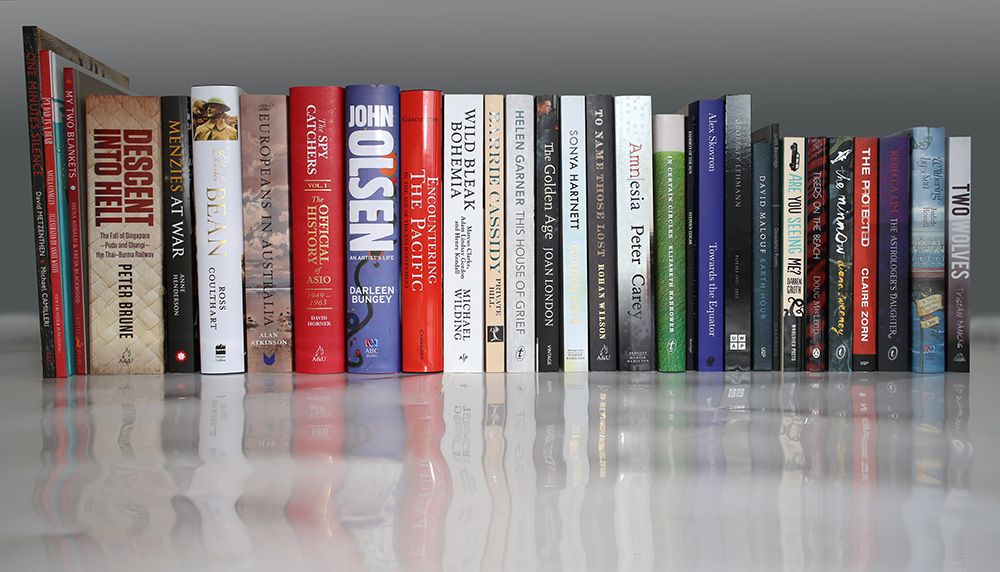
Find the location of `books on the left`. books on the left is located at coordinates (38, 196), (53, 200), (74, 201), (108, 204), (183, 206), (218, 209).